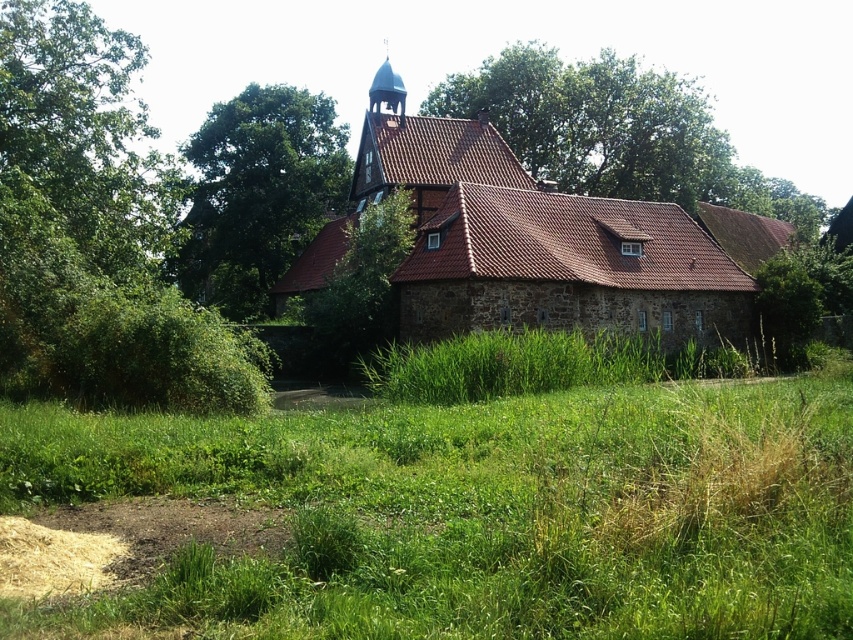
Question: Considering the real-world distances, which object is farthest from the light brown shredded hay at lower left?

Choices:
 (A) green leafy tree at upper left
 (B) brown stone church at center
 (C) green leafy tree at upper center

Answer: (C)

Question: Among these points, which one is farthest from the camera?

Choices:
 (A) (729, 282)
 (B) (602, 109)
 (C) (213, 262)
 (D) (85, 577)

Answer: (B)

Question: Among these objects, which one is farthest from the camera?

Choices:
 (A) green leafy tree at upper center
 (B) green grass at center
 (C) brown stone church at center

Answer: (A)

Question: Is green grass at center below green leafy tree at upper center?

Choices:
 (A) yes
 (B) no

Answer: (A)

Question: Considering the relative positions of green grass at center and green leafy tree at upper center in the image provided, where is green grass at center located with respect to green leafy tree at upper center?

Choices:
 (A) below
 (B) above

Answer: (A)

Question: Is green grass at center to the right of green leafy tree at upper left from the viewer's perspective?

Choices:
 (A) no
 (B) yes

Answer: (B)